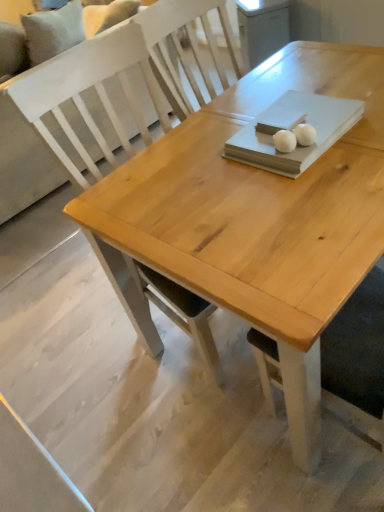
Question: Is white fabric couch at upper left in contact with white matte ball at center, which is the 1th food in left-to-right order?

Choices:
 (A) yes
 (B) no

Answer: (B)

Question: Is white fabric couch at upper left facing towards white matte ball at center, the second food viewed from the right?

Choices:
 (A) yes
 (B) no

Answer: (B)

Question: Can we say white fabric couch at upper left lies outside white matte ball at center, the second food viewed from the right?

Choices:
 (A) no
 (B) yes

Answer: (B)

Question: Considering the relative sizes of white fabric couch at upper left and white matte ball at center, which is the 1th food in left-to-right order, in the image provided, is white fabric couch at upper left bigger than white matte ball at center, which is the 1th food in left-to-right order,?

Choices:
 (A) yes
 (B) no

Answer: (A)

Question: From a real-world perspective, is white fabric couch at upper left physically above white matte ball at center, which is the 1th food in left-to-right order?

Choices:
 (A) no
 (B) yes

Answer: (A)

Question: In the image, is natural wood table at center on the left side or the right side of white glossy egg at upper center, arranged as the 1th food when viewed from the right?

Choices:
 (A) left
 (B) right

Answer: (A)

Question: From their relative heights in the image, would you say natural wood table at center is taller or shorter than white glossy egg at upper center, arranged as the 1th food when viewed from the right?

Choices:
 (A) short
 (B) tall

Answer: (B)

Question: Relative to white glossy egg at upper center, arranged as the second food when viewed from the left, is natural wood table at center in front or behind?

Choices:
 (A) behind
 (B) front

Answer: (B)

Question: Is natural wood table at center wider or thinner than white glossy egg at upper center, arranged as the 1th food when viewed from the right?

Choices:
 (A) wide
 (B) thin

Answer: (A)

Question: Does point click(286, 130) appear closer or farther from the camera than point click(306, 123)?

Choices:
 (A) closer
 (B) farther

Answer: (A)

Question: Looking at their shapes, would you say white matte ball at center, the second food viewed from the right, is wider or thinner than white glossy egg at upper center, arranged as the second food when viewed from the left?

Choices:
 (A) wide
 (B) thin

Answer: (A)

Question: From a real-world perspective, is white matte ball at center, which is the 1th food in left-to-right order, physically located above or below white glossy egg at upper center, arranged as the second food when viewed from the left?

Choices:
 (A) above
 (B) below

Answer: (A)

Question: Is white matte ball at center, which is the 1th food in left-to-right order, taller or shorter than white glossy egg at upper center, arranged as the second food when viewed from the left?

Choices:
 (A) tall
 (B) short

Answer: (A)

Question: Looking at their shapes, would you say white matte ball at center, which is the 1th food in left-to-right order, is wider or thinner than natural wood table at center?

Choices:
 (A) wide
 (B) thin

Answer: (B)

Question: Based on their positions, is white matte ball at center, which is the 1th food in left-to-right order, located to the left or right of natural wood table at center?

Choices:
 (A) right
 (B) left

Answer: (A)